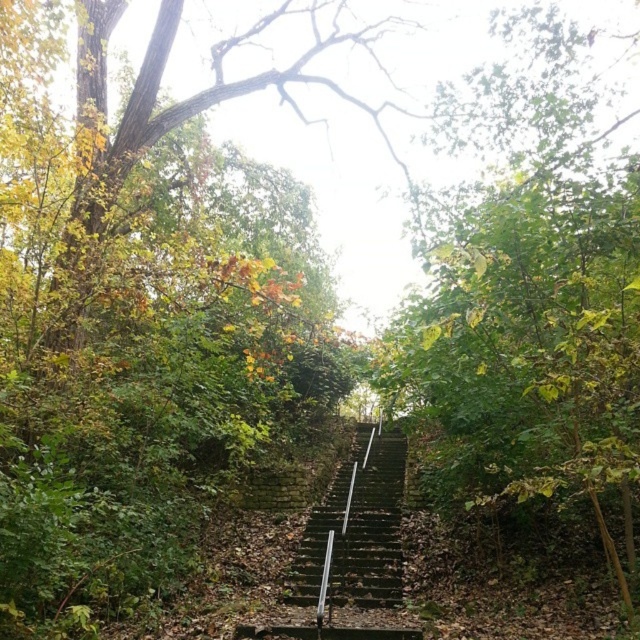
Who is positioned more to the right, green leafy tree at center or dark green stone stairs at center?

green leafy tree at center is more to the right.

You are a GUI agent. You are given a task and a screenshot of the screen. Output one action in this format:
    pyautogui.click(x=<x>, y=<y>)
    Task: Click on the green leafy tree at center
    
    Given the screenshot: What is the action you would take?
    pyautogui.click(x=531, y=298)